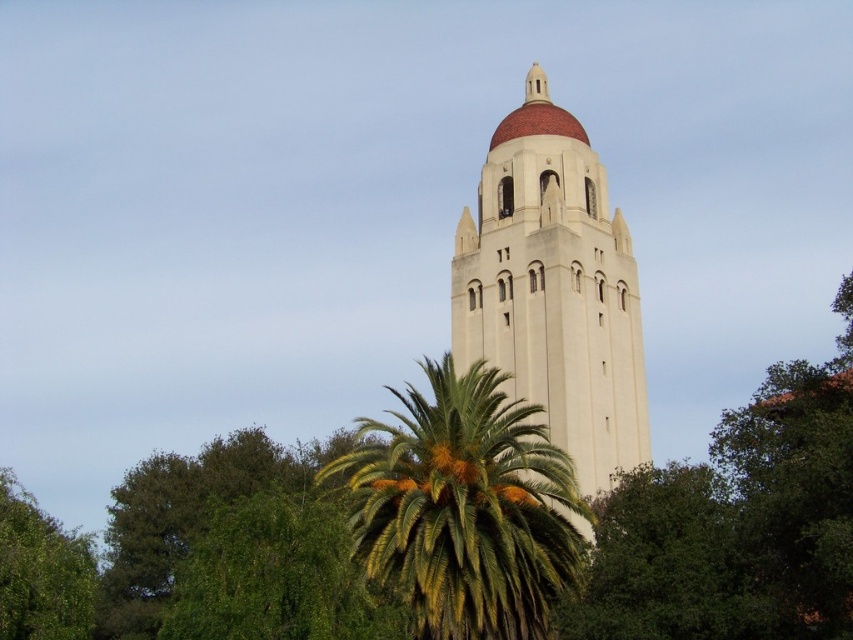
Can you confirm if white stucco tower at center is wider than green leafy palm at center?

In fact, white stucco tower at center might be narrower than green leafy palm at center.

Measure the distance from white stucco tower at center to green leafy palm at center.

A distance of 9.99 meters exists between white stucco tower at center and green leafy palm at center.

Consider the image. Measure the distance between white stucco tower at center and camera.

They are 59.90 meters apart.

Identify the location of white stucco tower at center. (554, 289).

Does white stucco tower at center have a lesser height compared to green leafy tree at lower left?

No.

Does white stucco tower at center appear under green leafy tree at lower left?

Incorrect, white stucco tower at center is not positioned below green leafy tree at lower left.

The width and height of the screenshot is (853, 640). What do you see at coordinates (554, 289) in the screenshot? I see `white stucco tower at center` at bounding box center [554, 289].

This screenshot has width=853, height=640. What are the coordinates of `white stucco tower at center` in the screenshot? It's located at (554, 289).

Is green leafy palm at center bigger than green leafy tree at lower left?

No.

Is point (469, 486) farther from viewer compared to point (7, 500)?

No, (469, 486) is in front of (7, 500).

At what (x,y) coordinates should I click in order to perform the action: click on green leafy palm at center. Please return your answer as a coordinate pair (x, y). The height and width of the screenshot is (640, 853). Looking at the image, I should click on (463, 508).